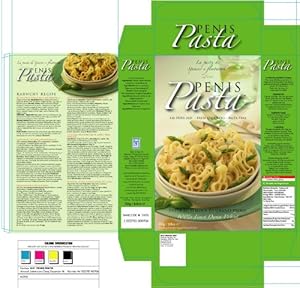
Where is `light grey wall`? The height and width of the screenshot is (288, 300). light grey wall is located at coordinates (165, 67).